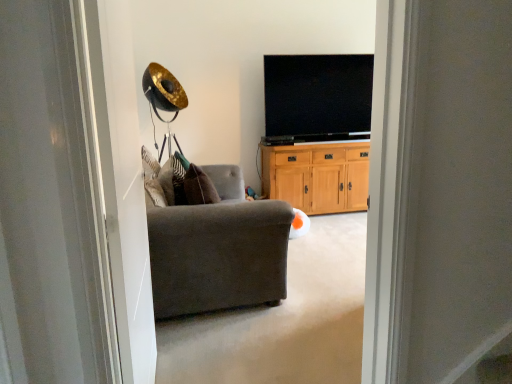
Question: From the image's perspective, relative to flat screen tv at upper center, is dark gray fabric armchair at center above or below?

Choices:
 (A) above
 (B) below

Answer: (B)

Question: Would you say dark gray fabric armchair at center is to the left or to the right of flat screen tv at upper center in the picture?

Choices:
 (A) left
 (B) right

Answer: (A)

Question: Estimate the real-world distances between objects in this image. Which object is closer to the transparent glass screen door at left?

Choices:
 (A) wooden cabinet at center
 (B) flat screen tv at upper center
 (C) dark gray fabric armchair at center

Answer: (C)

Question: Which object is the closest to the dark gray fabric armchair at center?

Choices:
 (A) transparent glass screen door at left
 (B) wooden cabinet at center
 (C) flat screen tv at upper center

Answer: (A)